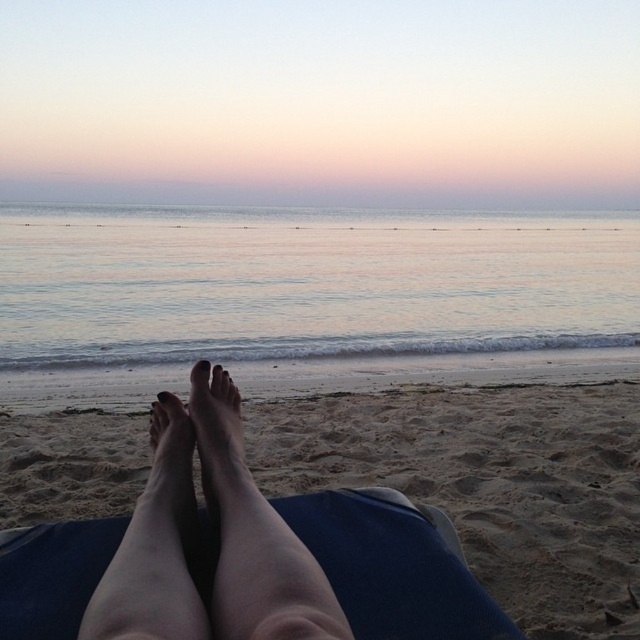
Which is behind, point (388, 614) or point (376, 188)?

The point (376, 188) is behind.

Does point (212, 561) lie in front of point (595, 195)?

Yes, it is.

Where is `blue fabric at lower center`? Image resolution: width=640 pixels, height=640 pixels. blue fabric at lower center is located at coordinates (394, 564).

Is the position of sandy beach at lower center less distant than that of pastel pink sky at upper center?

Yes, sandy beach at lower center is in front of pastel pink sky at upper center.

Who is positioned more to the left, sandy beach at lower center or pastel pink sky at upper center?

Positioned to the left is pastel pink sky at upper center.

Who is more distant from viewer, (442, 557) or (60, 200)?

The point (60, 200) is more distant.

This screenshot has width=640, height=640. I want to click on sandy beach at lower center, so pyautogui.click(x=236, y=556).

From the picture: Can you confirm if smooth skin leg at lower center is positioned above pastel pink sky at upper center?

Incorrect, smooth skin leg at lower center is not positioned above pastel pink sky at upper center.

Is smooth skin leg at lower center wider than pastel pink sky at upper center?

No, smooth skin leg at lower center is not wider than pastel pink sky at upper center.

The height and width of the screenshot is (640, 640). Find the location of `smooth skin leg at lower center`. smooth skin leg at lower center is located at coordinates (154, 548).

Where is `smooth skin leg at lower center`? smooth skin leg at lower center is located at coordinates (154, 548).